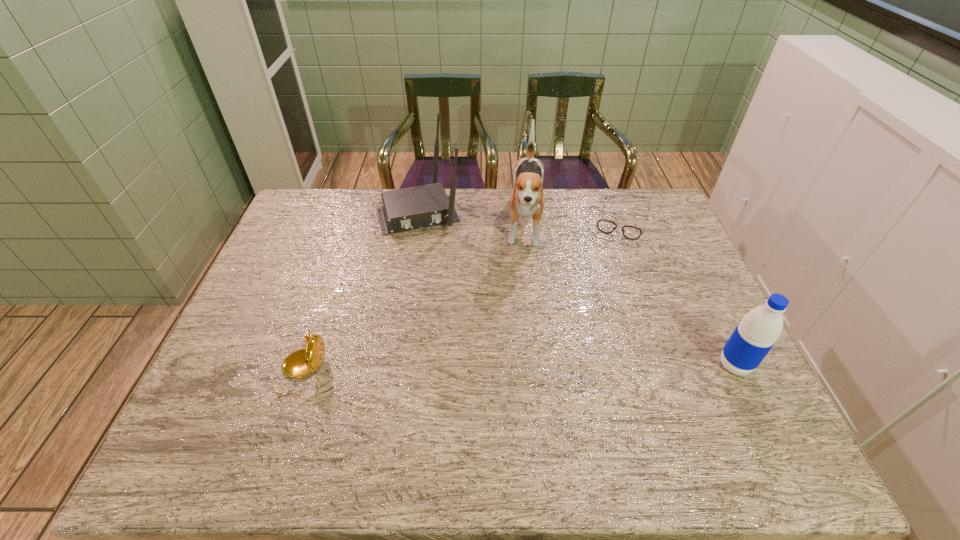
The height and width of the screenshot is (540, 960). In order to click on the fourth tallest object in this screenshot , I will do `click(300, 363)`.

The image size is (960, 540). Identify the location of the leftmost object. (300, 363).

In order to click on the third shortest object in this screenshot , I will do `click(758, 331)`.

The image size is (960, 540). In order to click on the rightmost object in this screenshot , I will do `click(758, 331)`.

This screenshot has height=540, width=960. In order to click on the shortest object in this screenshot , I will do `click(605, 226)`.

Find the location of a particular element. The image size is (960, 540). the second object from right to left is located at coordinates (605, 226).

Identify the location of the third object from left to right. This screenshot has width=960, height=540. (527, 198).

Where is `router`? Image resolution: width=960 pixels, height=540 pixels. router is located at coordinates (405, 209).

At what (x,y) coordinates should I click in order to perform the action: click on free space located 0.100m on the face of the leftmost object. Please return your answer as a coordinate pair (x, y). This screenshot has width=960, height=540. Looking at the image, I should click on (239, 374).

What are the coordinates of `vacant space located 0.110m on the face of the leftmost object` in the screenshot? It's located at (235, 374).